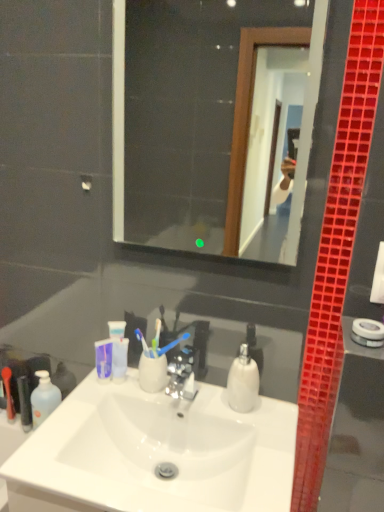
Question: Does black plastic tube at left, the second toiletry viewed from the left, have a greater height compared to white glossy soap dispenser at center?

Choices:
 (A) no
 (B) yes

Answer: (B)

Question: Are black plastic tube at left, the second toiletry viewed from the left, and white glossy soap dispenser at center located far from each other?

Choices:
 (A) yes
 (B) no

Answer: (B)

Question: Does black plastic tube at left, the second toiletry viewed from the left, turn towards white glossy soap dispenser at center?

Choices:
 (A) yes
 (B) no

Answer: (B)

Question: From a real-world perspective, is black plastic tube at left, the 1th toiletry when ordered from right to left, physically above white glossy soap dispenser at center?

Choices:
 (A) yes
 (B) no

Answer: (B)

Question: Is the depth of black plastic tube at left, the 1th toiletry when ordered from right to left, less than that of white glossy soap dispenser at center?

Choices:
 (A) no
 (B) yes

Answer: (A)

Question: Considering the positions of translucent plastic mouthwash at lower left and rubberized red toothbrush at lower left, which appears as the 1th toiletry when viewed from the left, in the image, is translucent plastic mouthwash at lower left bigger or smaller than rubberized red toothbrush at lower left, which appears as the 1th toiletry when viewed from the left,?

Choices:
 (A) big
 (B) small

Answer: (A)

Question: Considering the positions of translucent plastic mouthwash at lower left and rubberized red toothbrush at lower left, which appears as the 1th toiletry when viewed from the left, in the image, is translucent plastic mouthwash at lower left wider or thinner than rubberized red toothbrush at lower left, which appears as the 1th toiletry when viewed from the left,?

Choices:
 (A) wide
 (B) thin

Answer: (B)

Question: Considering their positions, is translucent plastic mouthwash at lower left located in front of or behind rubberized red toothbrush at lower left, marked as the 2th toiletry in a right-to-left arrangement?

Choices:
 (A) behind
 (B) front

Answer: (B)

Question: From the image's perspective, is translucent plastic mouthwash at lower left positioned above or below rubberized red toothbrush at lower left, which appears as the 1th toiletry when viewed from the left?

Choices:
 (A) below
 (B) above

Answer: (A)

Question: Considering the positions of black plastic tube at left, the 1th toiletry when ordered from right to left, and white glossy soap dispenser at center in the image, is black plastic tube at left, the 1th toiletry when ordered from right to left, wider or thinner than white glossy soap dispenser at center?

Choices:
 (A) wide
 (B) thin

Answer: (A)

Question: Considering their positions, is black plastic tube at left, the second toiletry viewed from the left, located in front of or behind white glossy soap dispenser at center?

Choices:
 (A) front
 (B) behind

Answer: (B)

Question: From a real-world perspective, is black plastic tube at left, the 1th toiletry when ordered from right to left, positioned above or below white glossy soap dispenser at center?

Choices:
 (A) below
 (B) above

Answer: (A)

Question: In terms of size, does black plastic tube at left, the second toiletry viewed from the left, appear bigger or smaller than white glossy soap dispenser at center?

Choices:
 (A) small
 (B) big

Answer: (A)

Question: Is black plastic tube at left, the 1th toiletry when ordered from right to left, spatially inside transparent glass mirror at upper center, or outside of it?

Choices:
 (A) outside
 (B) inside

Answer: (A)

Question: In the image, is black plastic tube at left, the second toiletry viewed from the left, positioned in front of or behind transparent glass mirror at upper center?

Choices:
 (A) front
 (B) behind

Answer: (B)